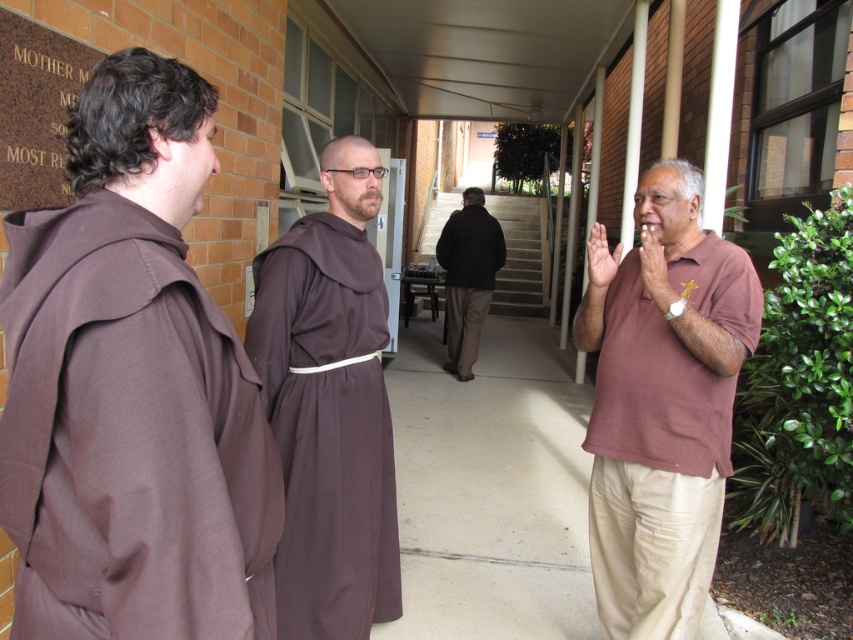
Question: Among these objects, which one is farthest from the camera?

Choices:
 (A) brown clothed monk at center
 (B) dark brown jacket at center

Answer: (B)

Question: Observing the image, what is the correct spatial positioning of brown cotton shirt at right in reference to dark brown jacket at center?

Choices:
 (A) right
 (B) left

Answer: (A)

Question: Is brown cotton robe at left below dark brown jacket at center?

Choices:
 (A) no
 (B) yes

Answer: (B)

Question: Which of the following is the farthest from the observer?

Choices:
 (A) dark brown jacket at center
 (B) brown clothed monk at center
 (C) brown cotton robe at left
 (D) brown cotton shirt at right

Answer: (A)

Question: Among these objects, which one is nearest to the camera?

Choices:
 (A) brown cotton shirt at right
 (B) brown clothed monk at center
 (C) dark brown jacket at center
 (D) brown cotton robe at left

Answer: (D)

Question: Is brown cotton robe at left wider than brown clothed monk at center?

Choices:
 (A) no
 (B) yes

Answer: (A)